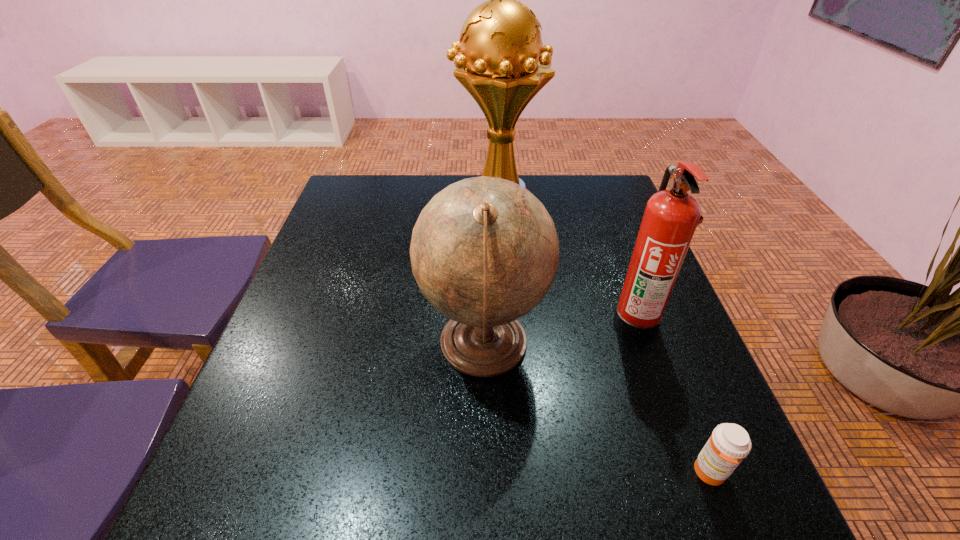
Identify the location of the farthest object. (503, 64).

This screenshot has width=960, height=540. I want to click on trophy_cup, so click(503, 64).

Find the location of `fire extinguisher`. fire extinguisher is located at coordinates (670, 219).

What are the coordinates of `globe` in the screenshot? It's located at (484, 251).

Where is `medicine`? medicine is located at coordinates (729, 444).

Identify the location of the shortest object. The image size is (960, 540). (729, 444).

Locate an element on the screen. This screenshot has width=960, height=540. vacant space situated at the front of the trophy_cup where the globe is prominent is located at coordinates (417, 197).

Locate an element on the screen. Image resolution: width=960 pixels, height=540 pixels. vacant space located at the front of the trophy_cup where the globe is prominent is located at coordinates (360, 197).

Locate an element on the screen. The width and height of the screenshot is (960, 540). vacant point located 0.090m at the front of the trophy_cup where the globe is prominent is located at coordinates (423, 197).

In order to click on vacant space located 0.300m with the nozzle pointing from the back of the fire extinguisher in this screenshot , I will do `click(473, 322)`.